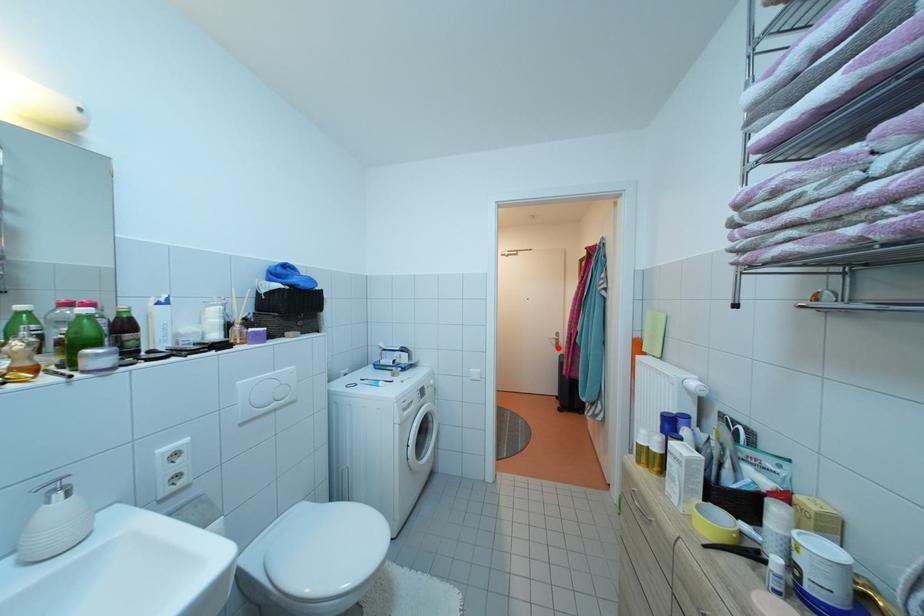
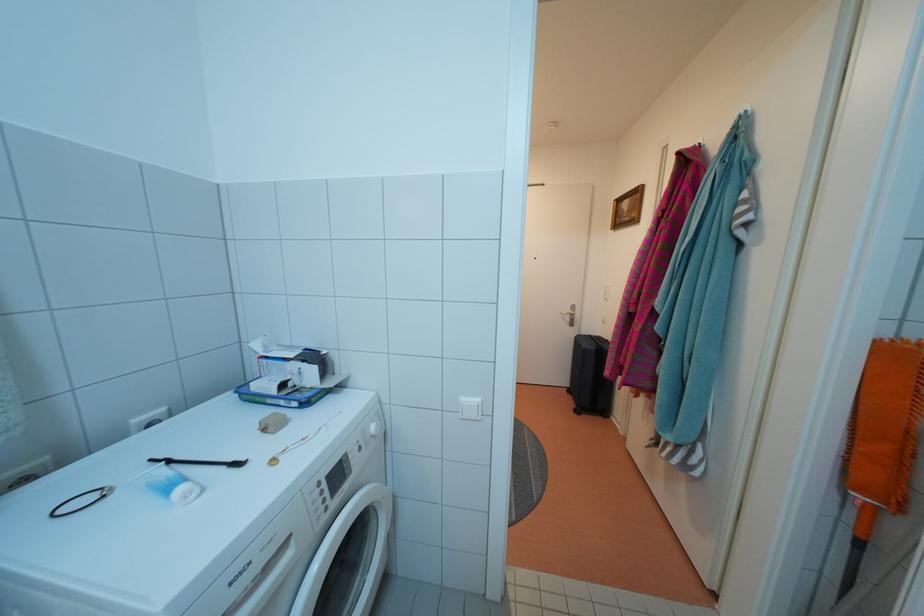
The point at the highlighted location is marked in the first image. Where is the corresponding point in the second image?

(570, 323)